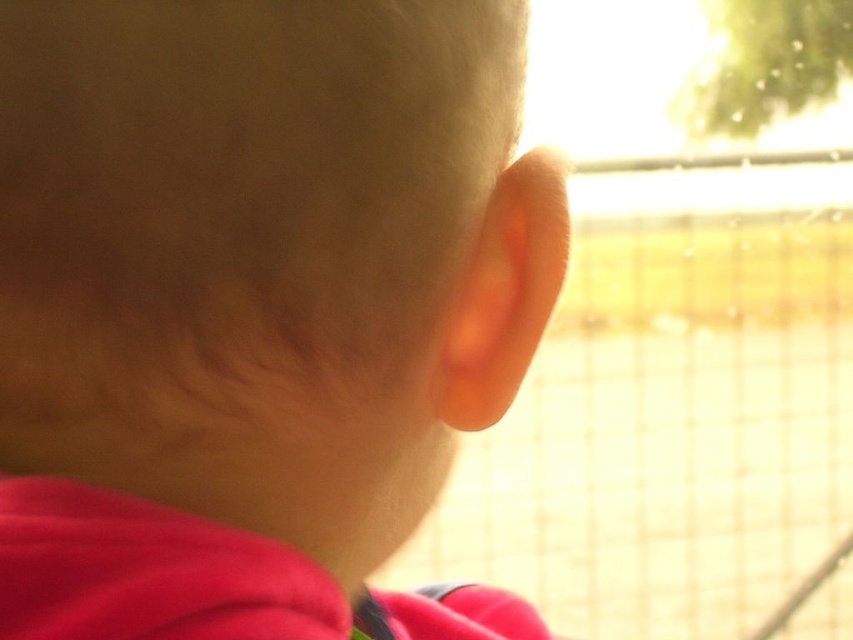
Question: In this image, where is smooth skin head at center located relative to transparent glass train window at center?

Choices:
 (A) above
 (B) below

Answer: (B)

Question: Which of the following is the closest to the observer?

Choices:
 (A) (329, 173)
 (B) (682, 611)

Answer: (A)

Question: Can you confirm if smooth skin head at center is positioned to the right of transparent glass train window at center?

Choices:
 (A) no
 (B) yes

Answer: (A)

Question: Can you confirm if smooth skin head at center is thinner than transparent glass train window at center?

Choices:
 (A) yes
 (B) no

Answer: (A)

Question: Which point appears closest to the camera in this image?

Choices:
 (A) (3, 76)
 (B) (749, 502)

Answer: (A)

Question: Which object appears farthest from the camera in this image?

Choices:
 (A) transparent glass train window at center
 (B) smooth skin head at center

Answer: (A)